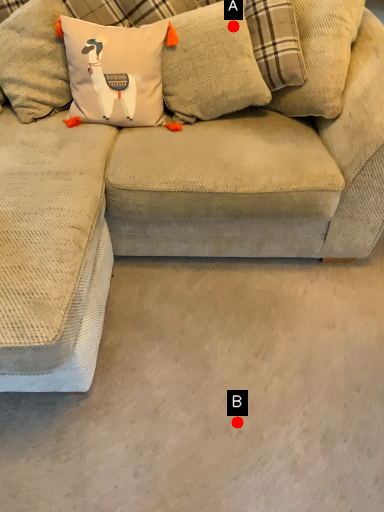
Question: Two points are circled on the image, labeled by A and B beside each circle. Which point is farther from the camera taking this photo?

Choices:
 (A) A is further
 (B) B is further

Answer: (A)